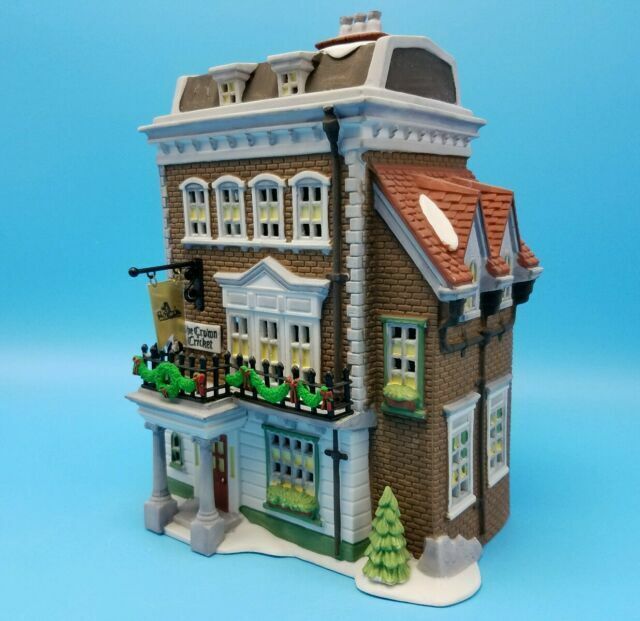
This screenshot has height=621, width=640. I want to click on front door, so click(221, 454).